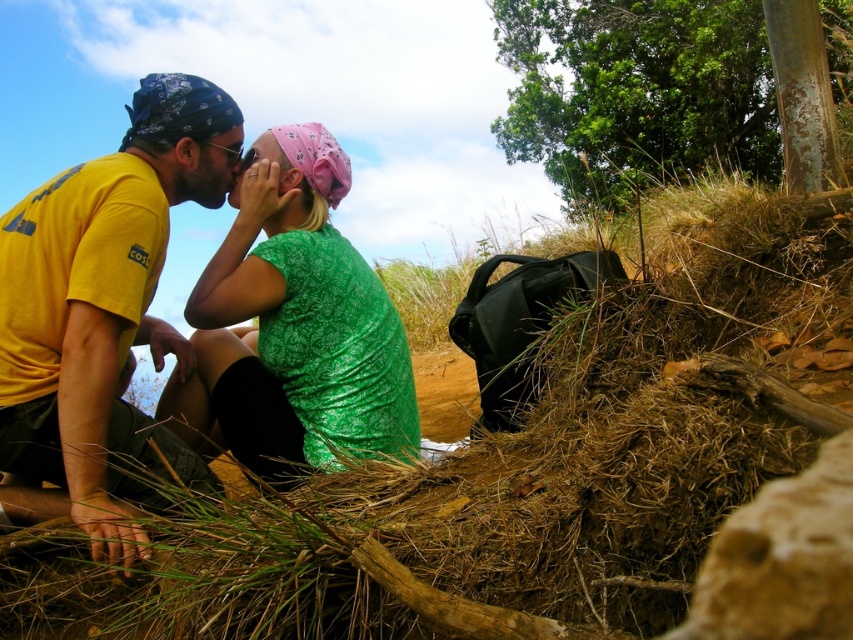
Based on the photo, does yellow matte t-shirt at left appear under pink fabric at center?

Yes.

Can you confirm if yellow matte t-shirt at left is positioned to the right of pink fabric at center?

No, yellow matte t-shirt at left is not to the right of pink fabric at center.

Does point (173, 77) lie in front of point (260, 141)?

Yes, it is in front of point (260, 141).

This screenshot has height=640, width=853. Identify the location of yellow matte t-shirt at left. (106, 308).

Based on the photo, between pink fabric headscarf at center and pink fabric at center, which one has less height?

pink fabric at center

Is pink fabric headscarf at center shorter than pink fabric at center?

No.

I want to click on pink fabric headscarf at center, so click(x=316, y=157).

At what (x,y) coordinates should I click in order to perform the action: click on pink fabric headscarf at center. Please return your answer as a coordinate pair (x, y). The height and width of the screenshot is (640, 853). Looking at the image, I should click on (316, 157).

Between green textured shirt at center and pink fabric at center, which one is positioned higher?

pink fabric at center is higher up.

Does point (332, 401) come behind point (247, 160)?

No, it is not.

Which is behind, point (300, 340) or point (258, 141)?

The point (258, 141) is behind.

Where is `green textured shirt at center`? green textured shirt at center is located at coordinates (293, 326).